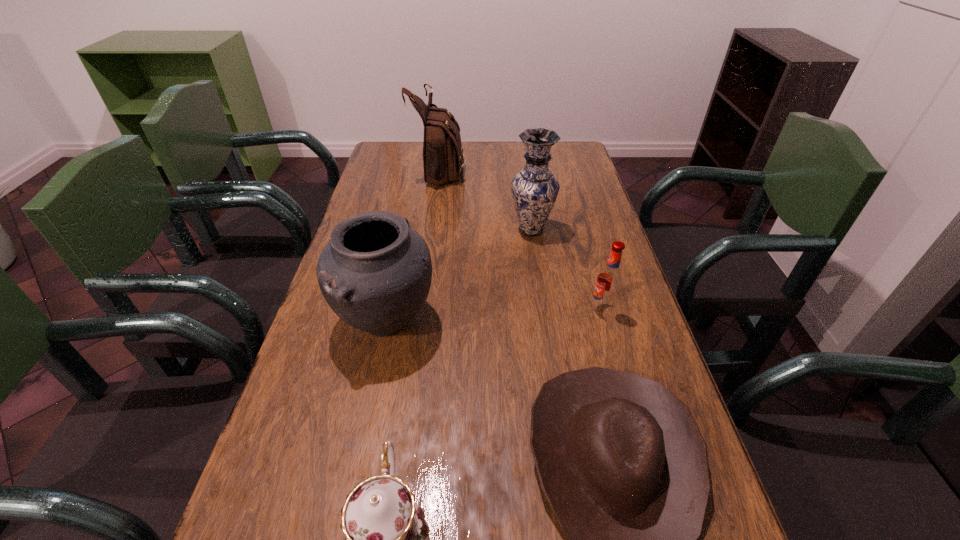
At what (x,y) coordinates should I click in order to perform the action: click on urn present at the left edge. Please return your answer as a coordinate pair (x, y). The height and width of the screenshot is (540, 960). Looking at the image, I should click on (375, 273).

Where is `object at the right edge`? The image size is (960, 540). object at the right edge is located at coordinates (609, 280).

Locate an element on the screen. The image size is (960, 540). object that is at the far left corner is located at coordinates (443, 155).

Where is `blank area at the far edge`? This screenshot has height=540, width=960. blank area at the far edge is located at coordinates (477, 158).

Locate an element on the screen. This screenshot has width=960, height=540. vacant space at the left edge of the desktop is located at coordinates (365, 187).

Identify the location of free space at the right edge of the desktop. (591, 209).

Where is `free space at the far left corner of the desktop`? free space at the far left corner of the desktop is located at coordinates (416, 160).

This screenshot has width=960, height=540. Find the location of `vacant area between the root beer and the shoulder bag`. vacant area between the root beer and the shoulder bag is located at coordinates (521, 240).

Locate which object is the second closest to the cowboy hat. Please provide its 2D coordinates. Your answer should be formatted as a tuple, i.e. [(x, y)], where the tuple contains the x and y coordinates of a point satisfying the conditions above.

[(609, 280)]

Find the location of `object that ranks as the fourth closest to the root beer`. object that ranks as the fourth closest to the root beer is located at coordinates (387, 537).